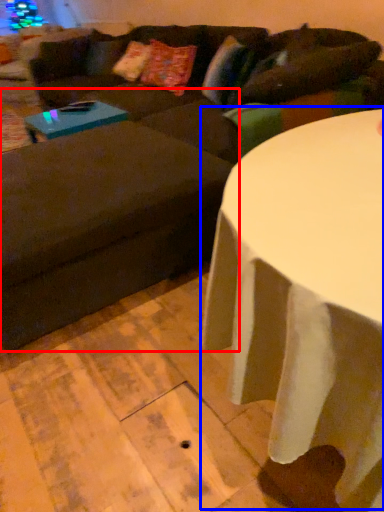
Question: Which of the following is the farthest to the observer, swivel chair (highlighted by a red box) or table (highlighted by a blue box)?

Choices:
 (A) swivel chair
 (B) table

Answer: (A)